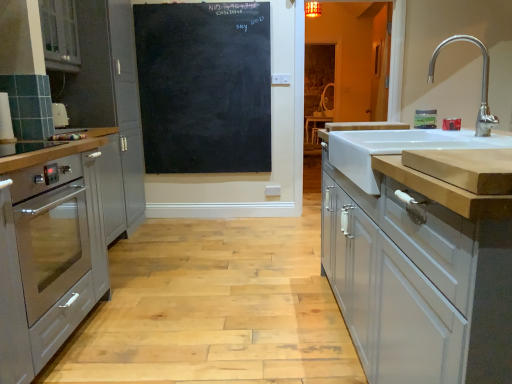
Question: Visually, is stainless steel oven at left positioned to the left or to the right of satin silver oven at left, arranged as the 3th cabinetry when viewed from the right?

Choices:
 (A) left
 (B) right

Answer: (B)

Question: Relative to satin silver oven at left, arranged as the 3th cabinetry when viewed from the right, is stainless steel oven at left in front or behind?

Choices:
 (A) behind
 (B) front

Answer: (B)

Question: Based on their relative distances, which object is farther from the white ceramic sink at right?

Choices:
 (A) green matte jar at upper right
 (B) stainless steel oven at left
 (C) white glossy cabinet at right, positioned as the fourth cabinetry in left-to-right order
 (D) satin silver oven at left, which is the third cabinetry in left-to-right order
 (E) satin silver oven at left, arranged as the 3th cabinetry when viewed from the right

Answer: (E)

Question: Estimate the real-world distances between objects in this image. Which object is farther from the stainless steel oven at left?

Choices:
 (A) white ceramic sink at right
 (B) white glossy cabinet at right, positioned as the fourth cabinetry in left-to-right order
 (C) green matte jar at upper right
 (D) black chalkboard at center
 (E) satin silver oven at left, placed as the second cabinetry when sorted from right to left

Answer: (C)